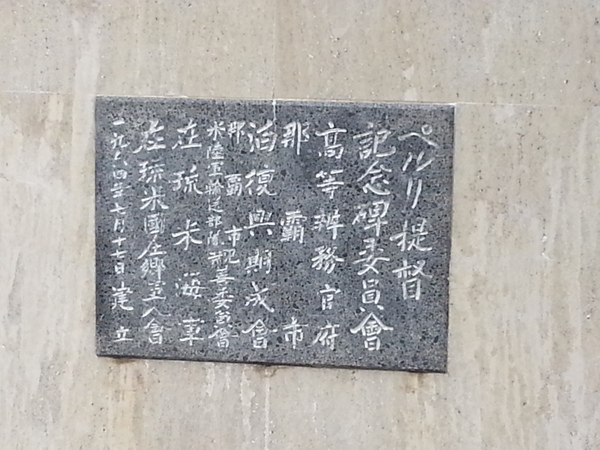
At what (x,y) coordinates should I click in order to perform the action: click on plaque artwork tile. Please return your answer as a coordinate pair (x, y). The height and width of the screenshot is (450, 600). Looking at the image, I should click on (490, 301).